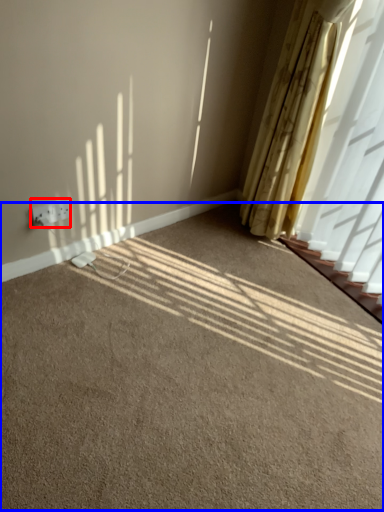
Question: Which of the following is the farthest to the observer, electric outlet (highlighted by a red box) or plain (highlighted by a blue box)?

Choices:
 (A) electric outlet
 (B) plain

Answer: (A)